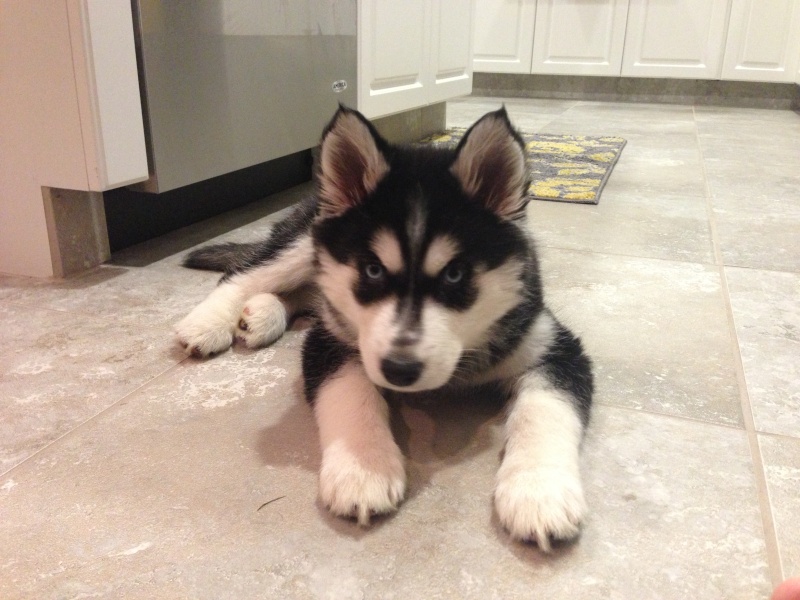
Where is `floor`? floor is located at coordinates (670, 365).